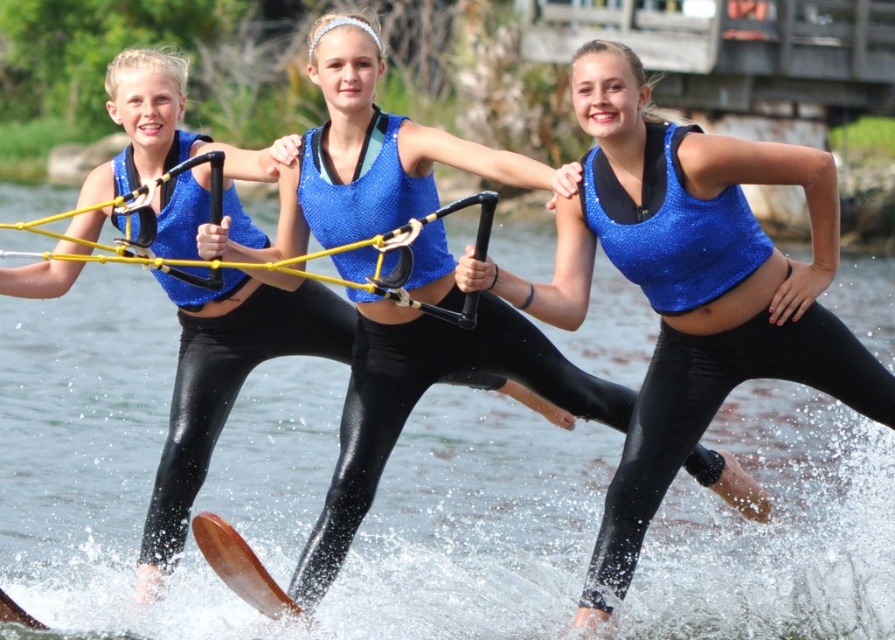
You are a photographer trying to capture a photo of the shiny blue fabric at center and the yellow rubber rope at center. Which object should you focus on first if you want to ensure both are in focus, given their relative sizes in the frame?

The shiny blue fabric at center is much taller than the yellow rubber rope at center, so focusing on the taller object first would help ensure both are in focus.

You are a photographer trying to capture the perfect shot of the yellow rubber rope at center and the brown wooden water ski at lower left. Based on their positions, which object should you focus on first to ensure both are in frame?

The yellow rubber rope at center is to the left of the brown wooden water ski at lower left, so you should focus on the brown wooden water ski at lower left first to ensure both are in frame.